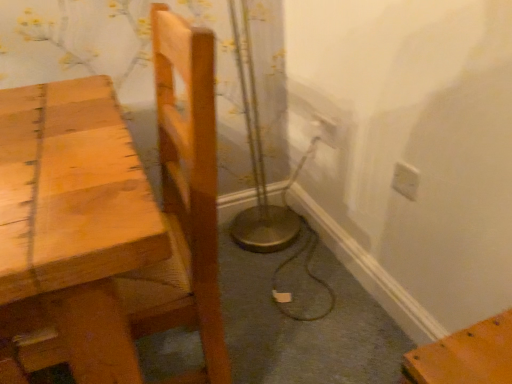
Question: Is light brown wooden chair at left thinner than white plastic electric outlet at upper right, acting as the 1th electric outlet starting from the left?

Choices:
 (A) yes
 (B) no

Answer: (B)

Question: Can you confirm if light brown wooden chair at left is shorter than white plastic electric outlet at upper right, the first electric outlet in the back-to-front sequence?

Choices:
 (A) yes
 (B) no

Answer: (B)

Question: Is light brown wooden chair at left oriented away from white plastic electric outlet at upper right, the second electric outlet positioned from the right?

Choices:
 (A) no
 (B) yes

Answer: (A)

Question: Is light brown wooden chair at left located outside white plastic electric outlet at upper right, the 2th electric outlet when ordered from bottom to top?

Choices:
 (A) yes
 (B) no

Answer: (A)

Question: Can you confirm if light brown wooden chair at left is taller than white plastic electric outlet at upper right, acting as the 1th electric outlet starting from the left?

Choices:
 (A) no
 (B) yes

Answer: (B)

Question: From the image's perspective, would you say light brown wooden chair at left is shown under white plastic electric outlet at upper right, the first electric outlet in the back-to-front sequence?

Choices:
 (A) no
 (B) yes

Answer: (B)

Question: Could you tell me if white plastic electric outlet at upper right, which is counted as the 2th electric outlet, starting from the front, is turned towards white plastic electric outlet at upper right, marked as the first electric outlet in a front-to-back arrangement?

Choices:
 (A) yes
 (B) no

Answer: (B)

Question: From a real-world perspective, is white plastic electric outlet at upper right, the 2th electric outlet when ordered from bottom to top, beneath white plastic electric outlet at upper right, the second electric outlet when ordered from left to right?

Choices:
 (A) yes
 (B) no

Answer: (A)

Question: From the image's perspective, is white plastic electric outlet at upper right, which is counted as the 2th electric outlet, starting from the front, located above white plastic electric outlet at upper right, marked as the first electric outlet in a front-to-back arrangement?

Choices:
 (A) yes
 (B) no

Answer: (A)

Question: Does white plastic electric outlet at upper right, the 2th electric outlet when ordered from bottom to top, lie behind white plastic electric outlet at upper right, the first electric outlet positioned from the right?

Choices:
 (A) yes
 (B) no

Answer: (A)

Question: Considering the relative sizes of white plastic electric outlet at upper right, the 2th electric outlet when ordered from bottom to top, and white plastic electric outlet at upper right, which is the 2th electric outlet in back-to-front order, in the image provided, is white plastic electric outlet at upper right, the 2th electric outlet when ordered from bottom to top, bigger than white plastic electric outlet at upper right, which is the 2th electric outlet in back-to-front order,?

Choices:
 (A) yes
 (B) no

Answer: (A)

Question: Is white plastic electric outlet at upper right, the first electric outlet in the back-to-front sequence, turned away from white plastic electric outlet at upper right, which is the 2th electric outlet in back-to-front order?

Choices:
 (A) yes
 (B) no

Answer: (B)

Question: Is white plastic electric outlet at upper right, the 2th electric outlet when ordered from bottom to top, smaller than light brown wooden chair at left?

Choices:
 (A) yes
 (B) no

Answer: (A)